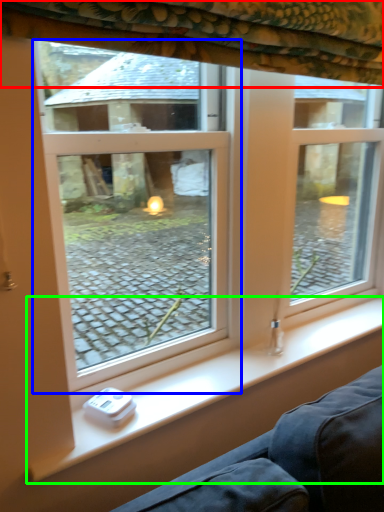
Question: Which is nearer to the curtain (highlighted by a red box)? window (highlighted by a blue box) or window sill (highlighted by a green box).

Choices:
 (A) window
 (B) window sill

Answer: (B)